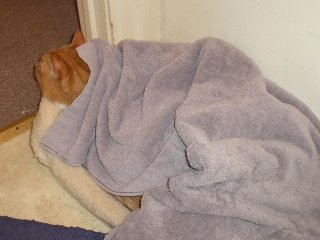
This screenshot has width=320, height=240. I want to click on blye towel, so click(37, 232).